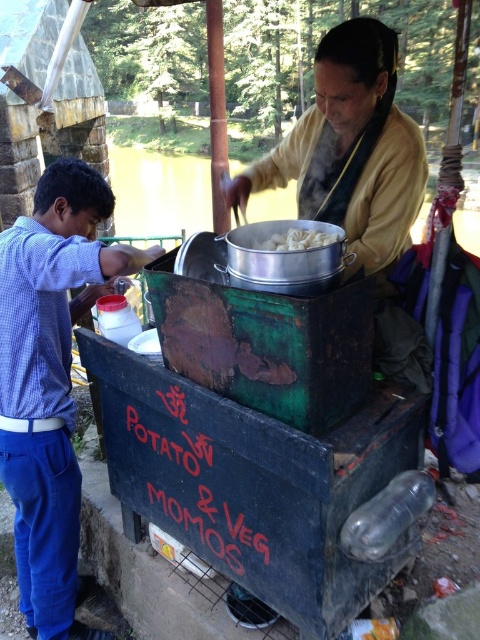
Which is more to the left, blue checkered shirt at left or white matte pot at center?

Positioned to the left is blue checkered shirt at left.

Does blue checkered shirt at left have a greater height compared to white matte pot at center?

Correct, blue checkered shirt at left is much taller as white matte pot at center.

Which is behind, point (32, 406) or point (296, 227)?

The point (32, 406) is behind.

The image size is (480, 640). What are the coordinates of `blue checkered shirt at left` in the screenshot? It's located at (50, 380).

Can you confirm if matte yellow shirt at center is thinner than white matte pot at center?

Incorrect, matte yellow shirt at center's width is not less than white matte pot at center's.

Can you confirm if matte yellow shirt at center is positioned above white matte pot at center?

Yes.

Which is behind, point (347, 140) or point (290, 228)?

The point (347, 140) is behind.

Find the location of a particular element. matte yellow shirt at center is located at coordinates (350, 148).

How much distance is there between blue checkered shirt at left and matte yellow shirt at center?

The distance of blue checkered shirt at left from matte yellow shirt at center is 3.69 feet.

Can you confirm if blue checkered shirt at left is thinner than matte yellow shirt at center?

In fact, blue checkered shirt at left might be wider than matte yellow shirt at center.

The height and width of the screenshot is (640, 480). Describe the element at coordinates (50, 380) in the screenshot. I see `blue checkered shirt at left` at that location.

This screenshot has width=480, height=640. Find the location of `blue checkered shirt at left`. blue checkered shirt at left is located at coordinates (50, 380).